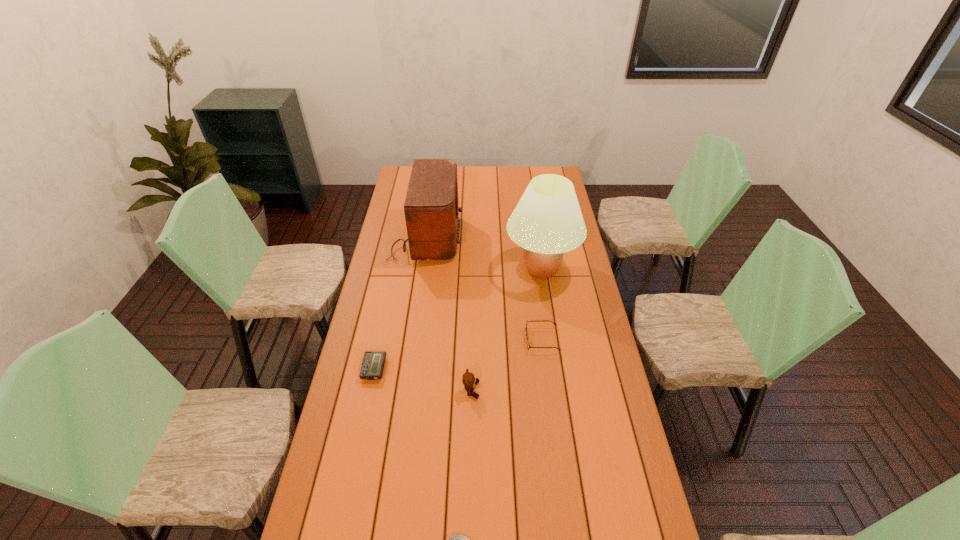
Where is `the tallest object`? the tallest object is located at coordinates (547, 221).

Where is `radio receiver`? This screenshot has width=960, height=540. radio receiver is located at coordinates (431, 208).

Find the location of a particular element. teddy bear is located at coordinates (x=468, y=379).

Where is `spectacles`? This screenshot has height=540, width=960. spectacles is located at coordinates click(528, 346).

Identify the location of beeper. (373, 362).

Find the location of a particular element. The width and height of the screenshot is (960, 540). vacant space situated on the shade of the tallest object is located at coordinates (428, 269).

Where is `free space located 0.190m on the shade of the tallest object`? free space located 0.190m on the shade of the tallest object is located at coordinates (461, 269).

I want to click on vacant space located 0.230m on the shade of the tallest object, so [x=451, y=269].

The width and height of the screenshot is (960, 540). Identify the location of vacant space located 0.190m on the front panel of the radio receiver. (502, 237).

Find the location of a particular element. free location located on the front-facing side of the teddy bear is located at coordinates (507, 390).